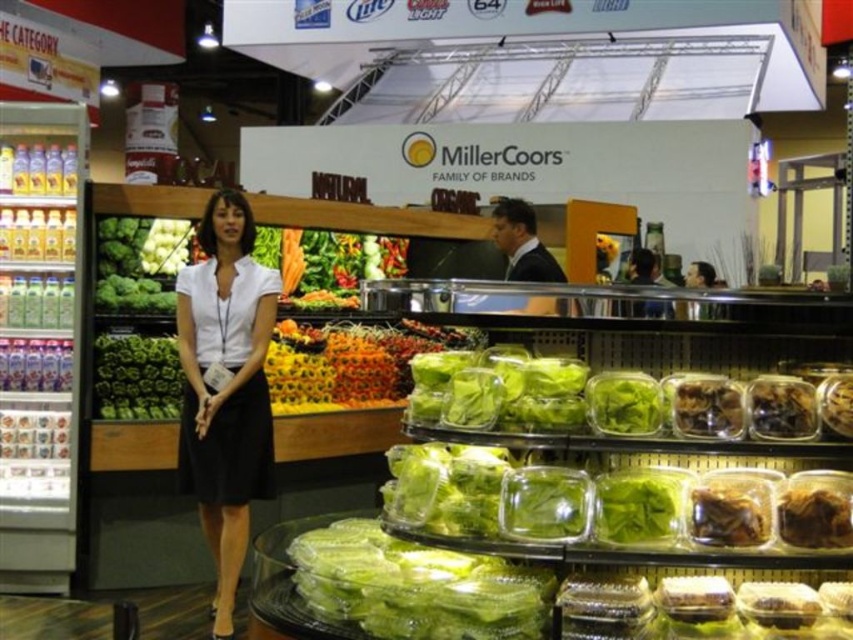
Question: Is green matte lettuce at center below brown matte dried mushrooms at center?

Choices:
 (A) yes
 (B) no

Answer: (A)

Question: Does brown matte dried fruits at lower right have a larger size compared to brown matte nuts at center?

Choices:
 (A) no
 (B) yes

Answer: (B)

Question: Which object is the farthest from the white matte shirt at center?

Choices:
 (A) green leafy lettuce at center
 (B) brown matte dried fruits at lower right
 (C) brown crumbly at lower right

Answer: (C)

Question: Can you confirm if green matte lettuce at center is positioned to the right of brown crumbly at lower right?

Choices:
 (A) no
 (B) yes

Answer: (A)

Question: Which point is closer to the camera?

Choices:
 (A) (828, 496)
 (B) (602, 477)
 (C) (778, 381)
 (D) (734, 420)

Answer: (A)

Question: Which object is farther from the camera taking this photo?

Choices:
 (A) white matte shirt at center
 (B) green leafy lettuce at center

Answer: (B)